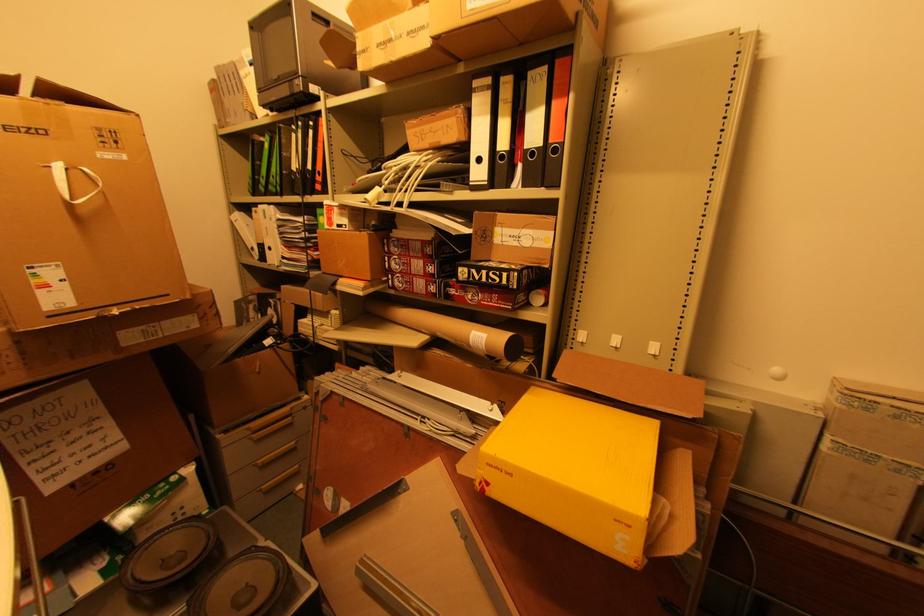
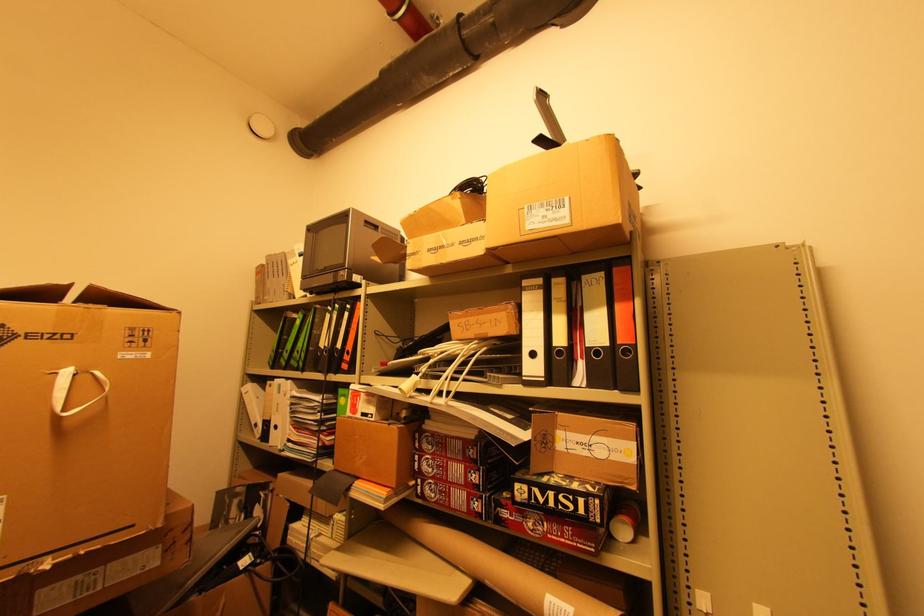
Locate, in the second image, the point that corresponds to (529,302) in the first image.

(611, 535)